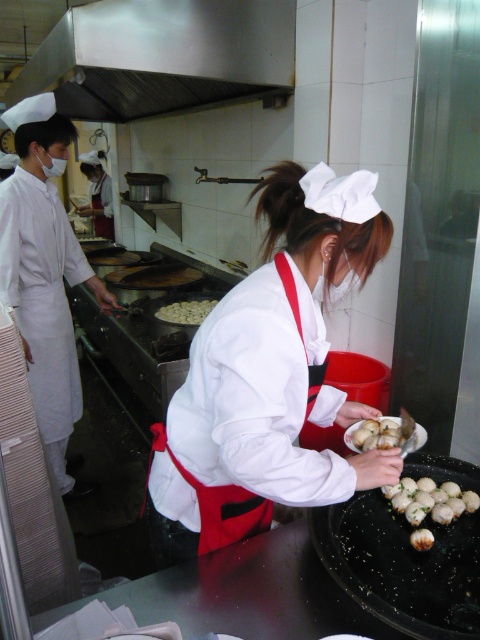
You are standing in the kitchen and want to reach the point at coordinates point (286, 54). Can you estimate how far you need to walk to get there?

The point (286, 54) is 7.77 feet away from the viewer, so you need to walk approximately 7.77 feet to reach it.

You are a chef in the kitchen and need to determine which item is narrower between the white matte apron at center and the stainless steel exhaust hood at upper center. Which one is it?

The white matte apron at center is thinner than the stainless steel exhaust hood at upper center, so the white matte apron at center is narrower.